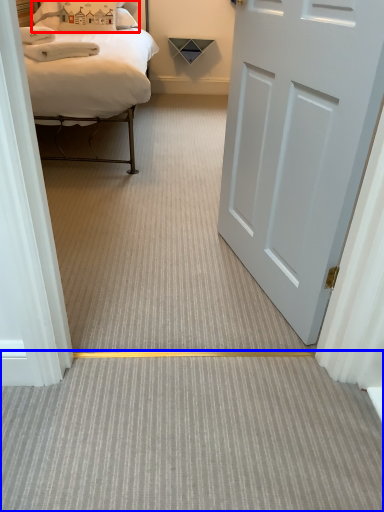
Question: Among these objects, which one is nearest to the camera, pillow (highlighted by a red box) or plain (highlighted by a blue box)?

Choices:
 (A) pillow
 (B) plain

Answer: (B)